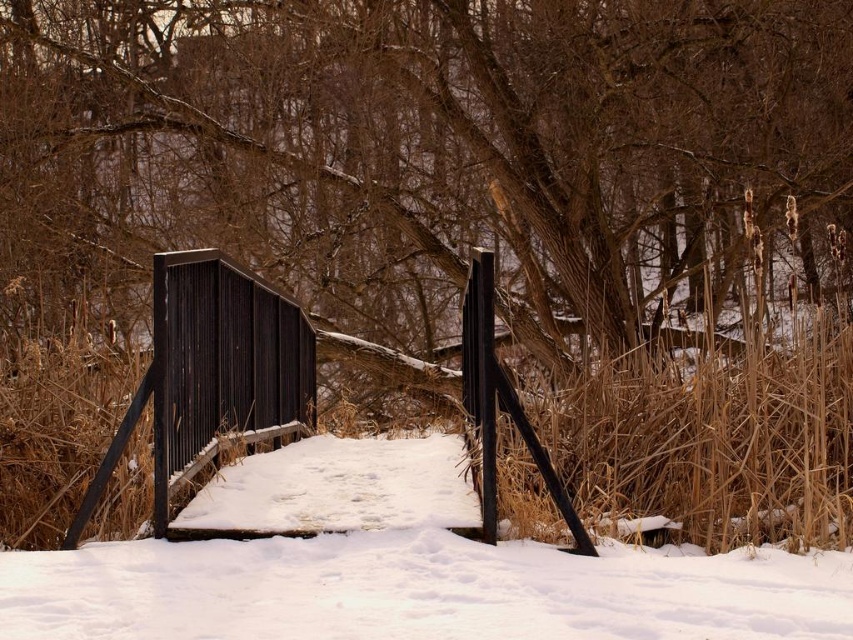
Question: Is white powdery snow at center further to the viewer compared to black corrugated metal fence at center?

Choices:
 (A) yes
 (B) no

Answer: (B)

Question: Which object appears closest to the camera in this image?

Choices:
 (A) brown wood tree at center
 (B) black corrugated metal fence at center

Answer: (B)

Question: Can you confirm if brown wood tree at center is thinner than black corrugated metal fence at center?

Choices:
 (A) yes
 (B) no

Answer: (B)

Question: Is brown wood tree at center to the left of white powdery snow at center from the viewer's perspective?

Choices:
 (A) yes
 (B) no

Answer: (B)

Question: Which point appears farthest from the camera in this image?

Choices:
 (A) (306, 349)
 (B) (668, 612)
 (C) (677, 35)

Answer: (A)

Question: Estimate the real-world distances between objects in this image. Which object is closer to the black corrugated metal fence at center?

Choices:
 (A) white powdery snow at center
 (B) brown wood tree at center

Answer: (A)